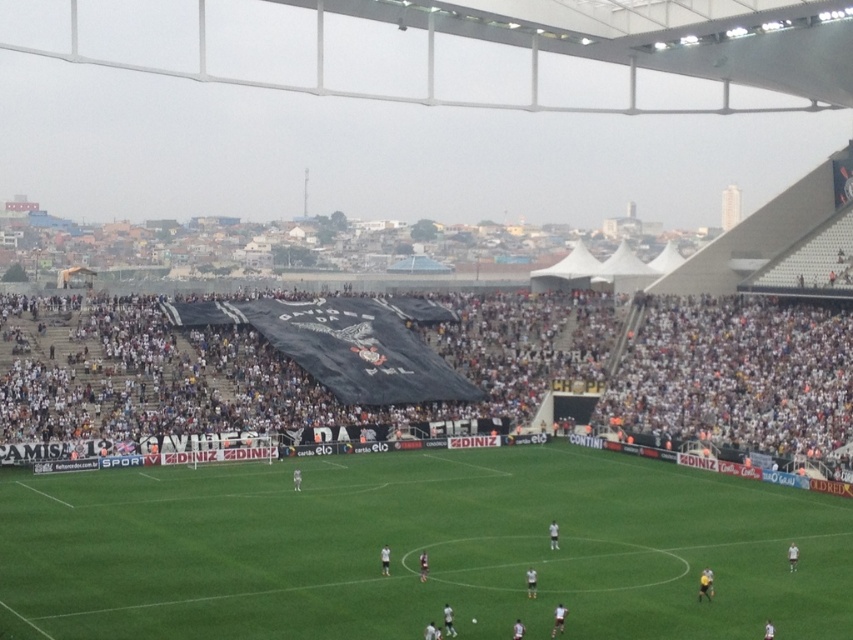
Question: Which object appears farthest from the camera in this image?

Choices:
 (A) black fabric banner at center
 (B) green grass football field at center

Answer: (A)

Question: Is green grass football field at center below black fabric banner at center?

Choices:
 (A) no
 (B) yes

Answer: (B)

Question: Is green grass football field at center behind black fabric banner at center?

Choices:
 (A) no
 (B) yes

Answer: (A)

Question: Which of the following is the closest to the observer?

Choices:
 (A) green grass football field at center
 (B) black fabric banner at center

Answer: (A)

Question: Does green grass football field at center appear under black fabric banner at center?

Choices:
 (A) yes
 (B) no

Answer: (A)

Question: Which object is closer to the camera taking this photo?

Choices:
 (A) green grass football field at center
 (B) black fabric banner at center

Answer: (A)